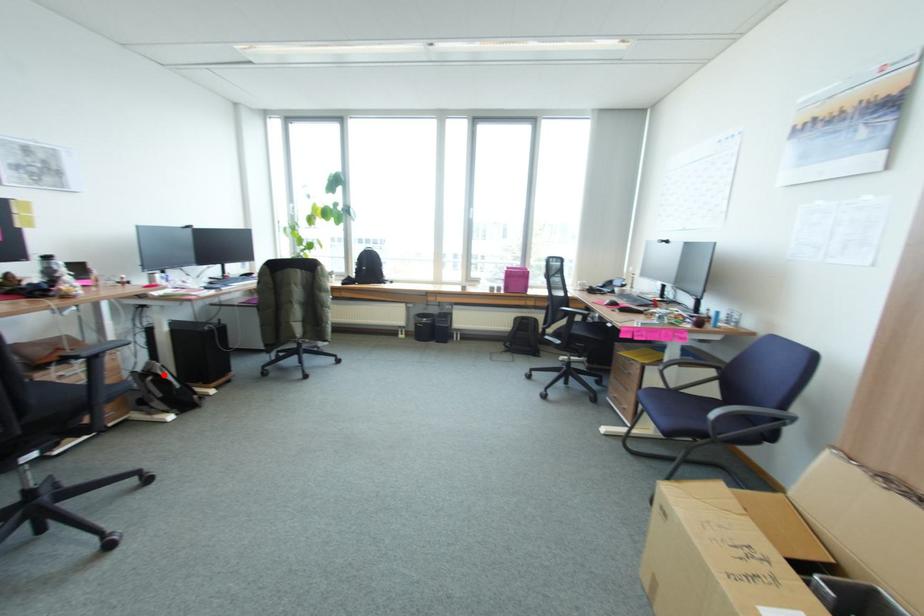
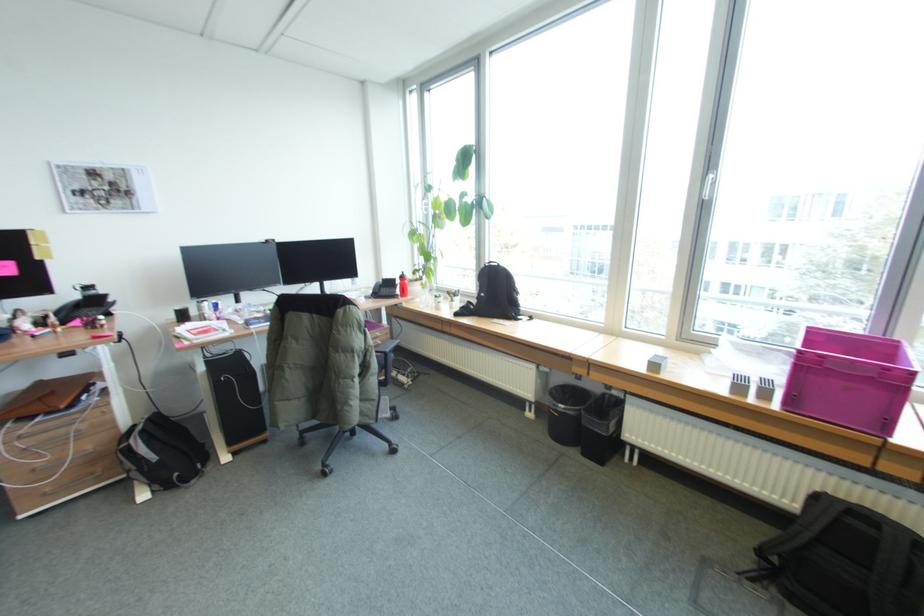
Where in the second image is the point corresponding to the highlighted location from the first image?

(135, 444)